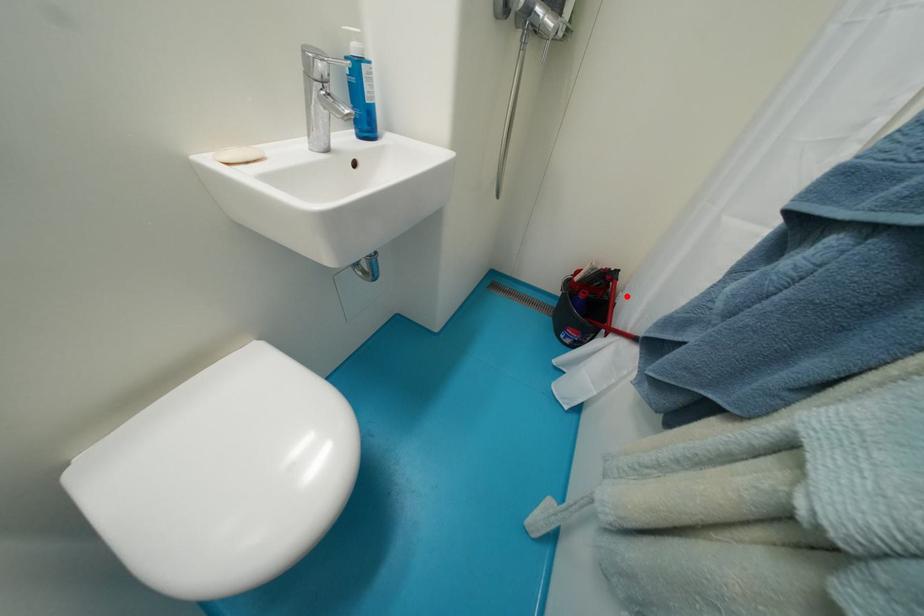
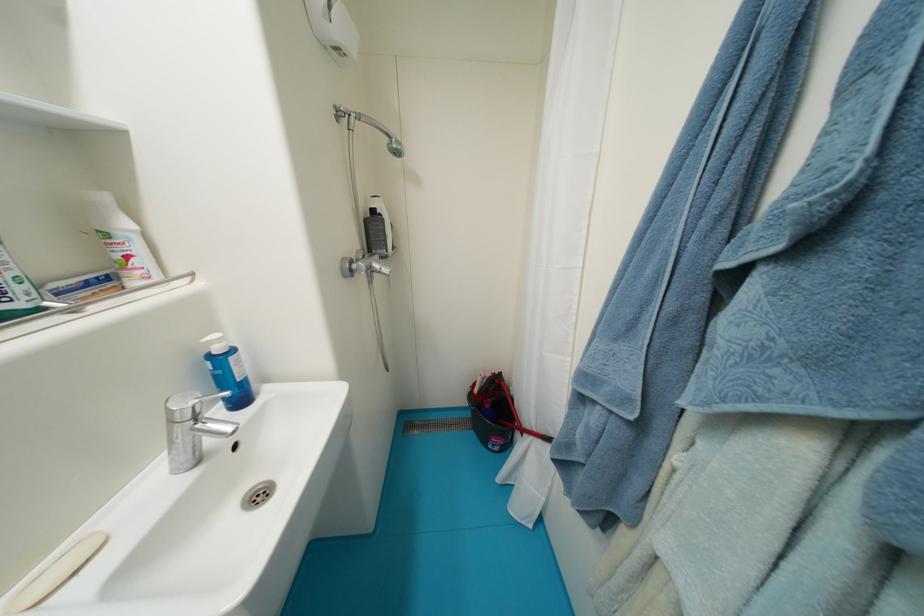
In the second image, find the point that corresponds to the highlighted location in the first image.

(517, 390)